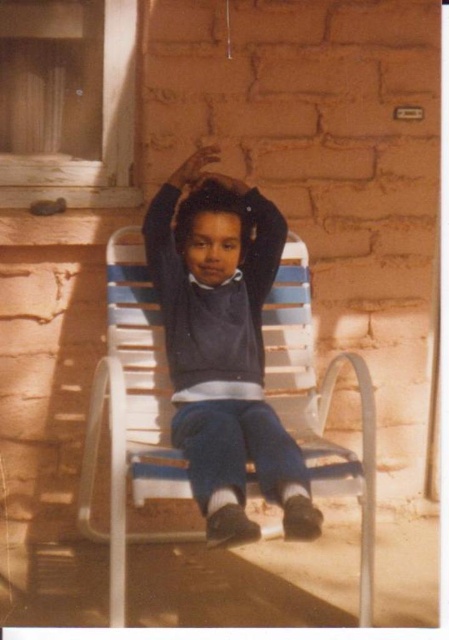
Question: Is white plastic chair at center closer to camera compared to matte black hand at upper center?

Choices:
 (A) yes
 (B) no

Answer: (A)

Question: Which is farther from the white plastic chair at center?

Choices:
 (A) matte blue pants at center
 (B) matte black hand at upper center

Answer: (B)

Question: Among these points, which one is nearest to the camera?

Choices:
 (A) (202, 408)
 (B) (203, 150)

Answer: (A)

Question: Among these points, which one is farthest from the camera?

Choices:
 (A) (211, 406)
 (B) (208, 147)
 (C) (330, 445)

Answer: (B)

Question: Observing the image, what is the correct spatial positioning of matte blue pants at center in reference to matte black hand at upper center?

Choices:
 (A) right
 (B) left

Answer: (A)

Question: Can you confirm if white plastic chair at center is wider than matte black hand at upper center?

Choices:
 (A) no
 (B) yes

Answer: (B)